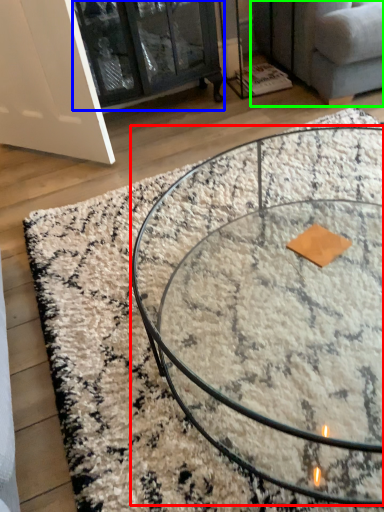
Question: Estimate the real-world distances between objects in this image. Which object is closer to coffee table (highlighted by a red box), glass door (highlighted by a blue box) or studio couch (highlighted by a green box)?

Choices:
 (A) glass door
 (B) studio couch

Answer: (B)